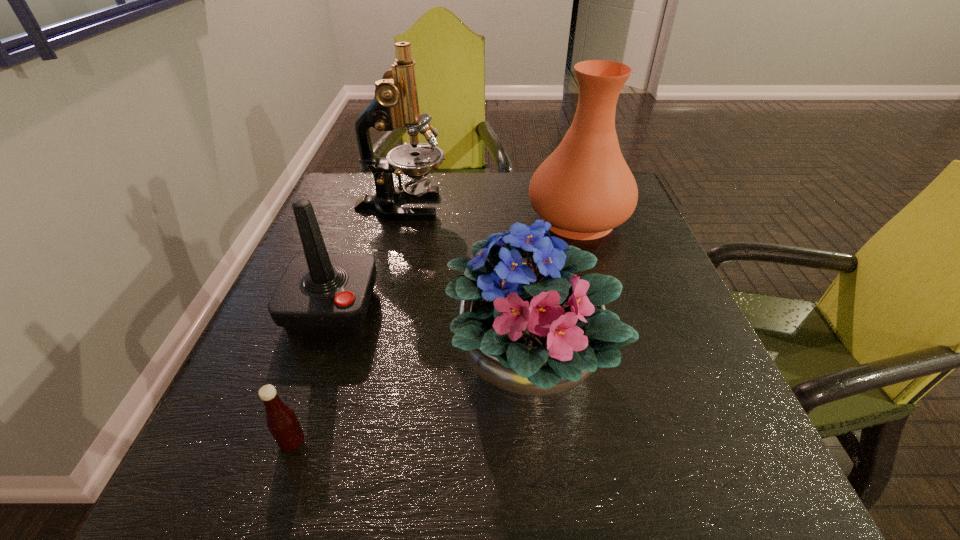
The image size is (960, 540). In order to click on microscope in this screenshot , I will do `click(395, 103)`.

The image size is (960, 540). Find the location of `vase`. vase is located at coordinates (584, 188).

Identify the location of bouquet. This screenshot has width=960, height=540. (533, 331).

Identify the location of joystick. The height and width of the screenshot is (540, 960). (319, 292).

Find the location of a particular element. the shortest object is located at coordinates (282, 422).

Identify the location of free spot located 0.200m at the eyepiece of the microscope. (525, 207).

Identify the location of free point located 0.360m on the front of the vase. This screenshot has height=540, width=960. pyautogui.click(x=627, y=382).

Where is `vacant space located on the left of the bouquet`? vacant space located on the left of the bouquet is located at coordinates (287, 364).

You are a GUI agent. You are given a task and a screenshot of the screen. Output one action in this format:
    pyautogui.click(x=<x>, y=<y>)
    Task: Click on the blank space located 0.280m on the back of the joystick
    
    Given the screenshot: What is the action you would take?
    pyautogui.click(x=368, y=207)

Identify the location of free space located 0.090m on the back of the Tabasco sauce. point(314,381).